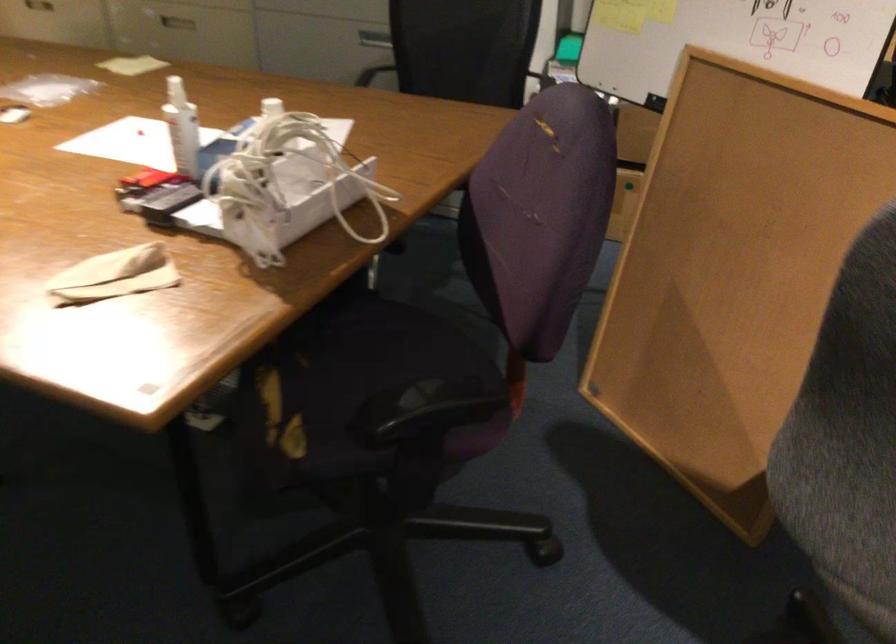
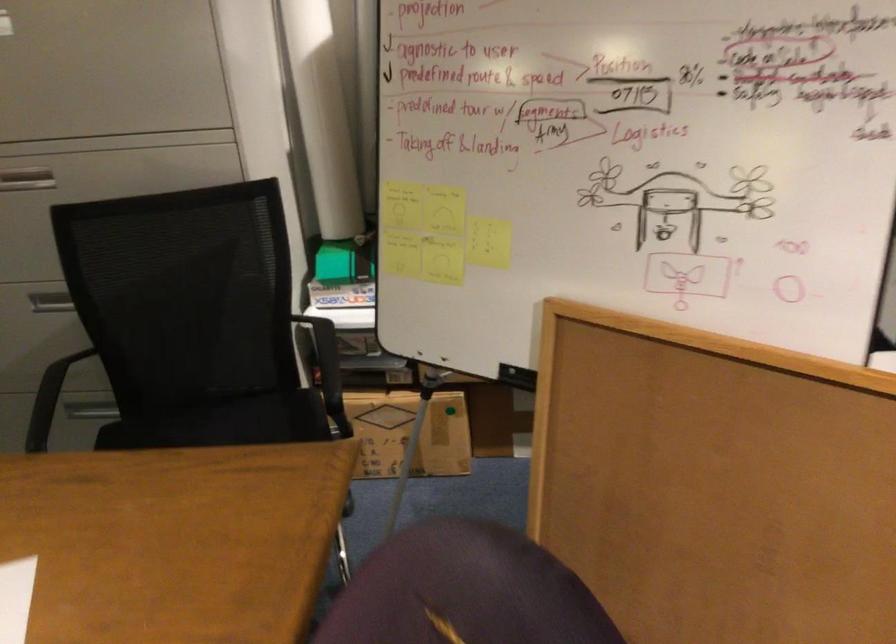
Question: The images are taken continuously from a first-person perspective. In which direction are you moving?

Choices:
 (A) Left
 (B) Right
 (C) Forward
 (D) Backward

Answer: (C)